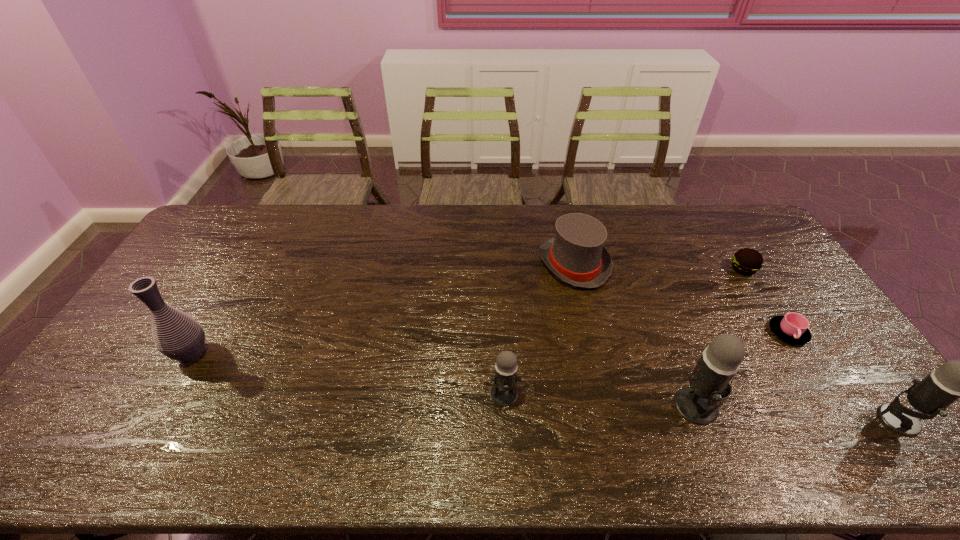
Where is `patty that is at the right edge`? patty that is at the right edge is located at coordinates (747, 261).

Locate an element on the screen. Image resolution: width=960 pixels, height=540 pixels. cup that is at the right edge is located at coordinates (793, 327).

The width and height of the screenshot is (960, 540). Find the location of `object present at the near right corner`. object present at the near right corner is located at coordinates (955, 379).

This screenshot has height=540, width=960. In the image, there is a desktop. Find the location of `vacant space at the far edge`. vacant space at the far edge is located at coordinates (535, 232).

Where is `vacant space at the near edge`? vacant space at the near edge is located at coordinates (818, 418).

The image size is (960, 540). In the image, there is a desktop. Find the location of `vacant space at the right edge`. vacant space at the right edge is located at coordinates (787, 290).

This screenshot has width=960, height=540. Find the location of `free location at the far left corner`. free location at the far left corner is located at coordinates (207, 234).

Image resolution: width=960 pixels, height=540 pixels. In the image, there is a desktop. Identify the location of free space at the near left corner. (99, 400).

You are a GUI agent. You are given a task and a screenshot of the screen. Output one action in this format:
    pyautogui.click(x=<x>, y=<y>)
    Task: Click on the vacant space at the far right corner
    
    Given the screenshot: What is the action you would take?
    pyautogui.click(x=701, y=205)

Where is `vacant region at the near right corner of the desktop`? The width and height of the screenshot is (960, 540). vacant region at the near right corner of the desktop is located at coordinates (822, 402).